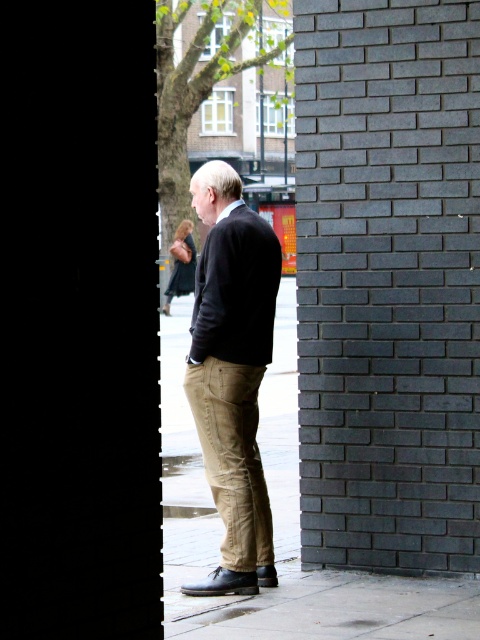
Question: Which point is farther to the camera?

Choices:
 (A) khaki cotton pants at center
 (B) dark brown leather shoes at center
 (C) dark gray brick wall at right

Answer: (C)

Question: Is dark gray brick wall at right to the right of khaki cotton pants at center from the viewer's perspective?

Choices:
 (A) yes
 (B) no

Answer: (A)

Question: Observing the image, what is the correct spatial positioning of dark brown leather shoes at center in reference to khaki cotton pants at center?

Choices:
 (A) below
 (B) above

Answer: (B)

Question: Estimate the real-world distances between objects in this image. Which object is farther from the dark gray brick wall at right?

Choices:
 (A) khaki cotton pants at center
 (B) dark brown leather shoes at center

Answer: (A)

Question: Does dark gray brick wall at right appear on the right side of khaki cotton pants at center?

Choices:
 (A) yes
 (B) no

Answer: (A)

Question: Which of the following is the farthest from the observer?

Choices:
 (A) (216, 444)
 (B) (349, 355)
 (C) (264, 508)

Answer: (B)